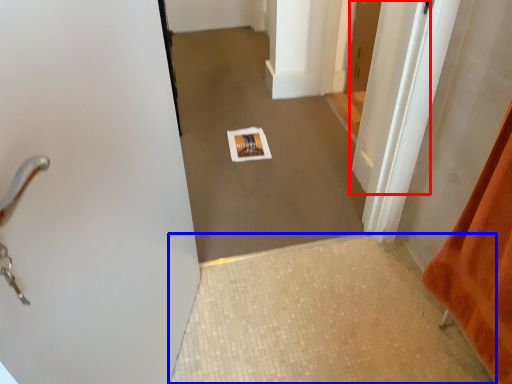
Question: Which of the following is the closest to the observer, door (highlighted by a red box) or tile (highlighted by a blue box)?

Choices:
 (A) door
 (B) tile

Answer: (B)